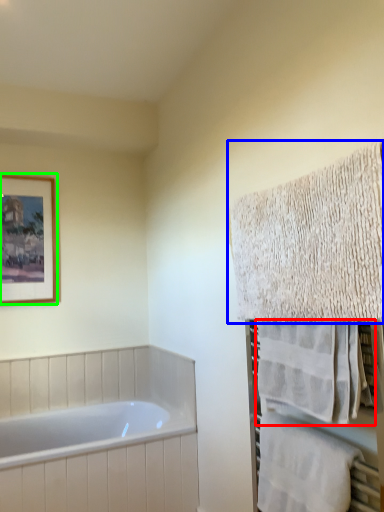
Question: Considering the real-world distances, which object is farthest from towel (highlighted by a red box)? towel (highlighted by a blue box) or picture frame (highlighted by a green box)?

Choices:
 (A) towel
 (B) picture frame

Answer: (B)